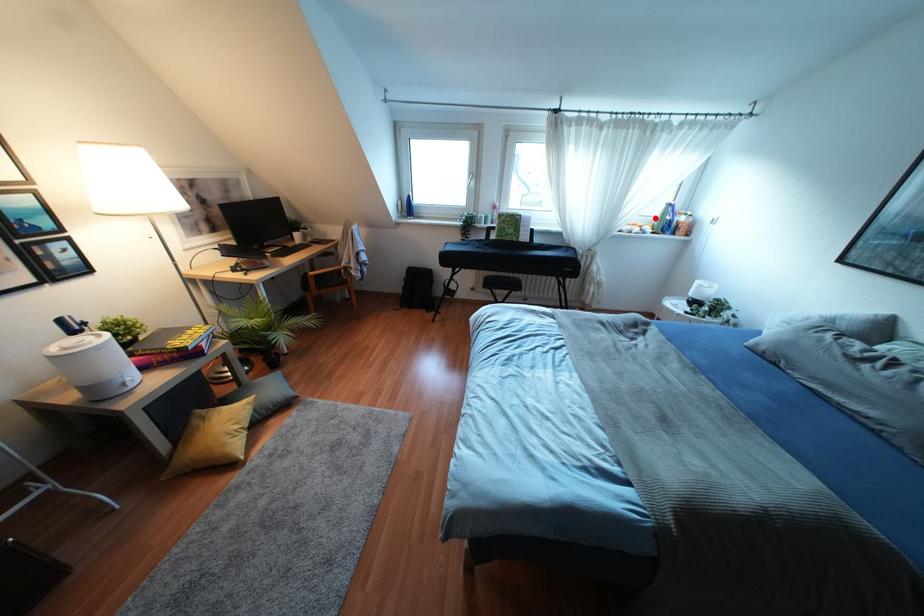
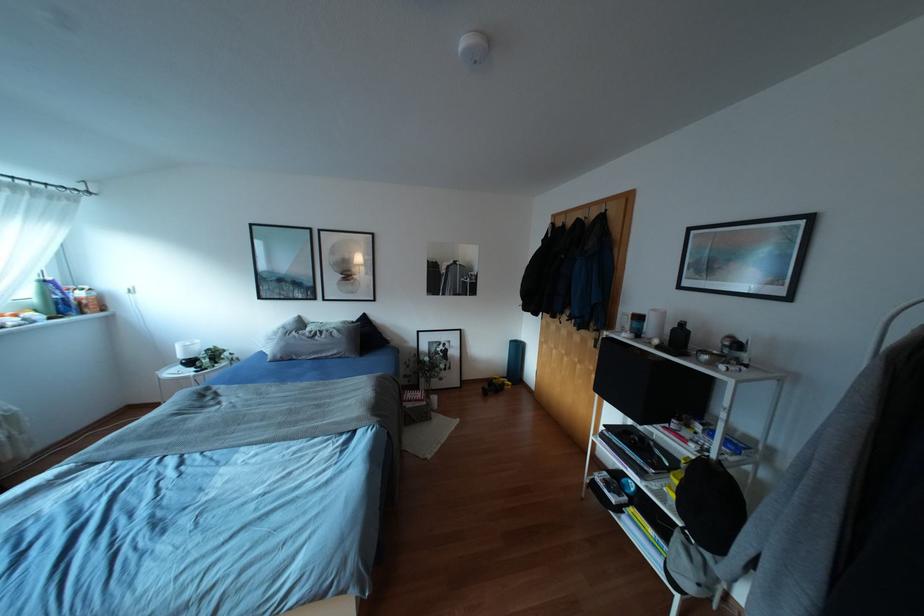
In the second image, find the point that corresponds to the highlighted location in the first image.

(35, 301)